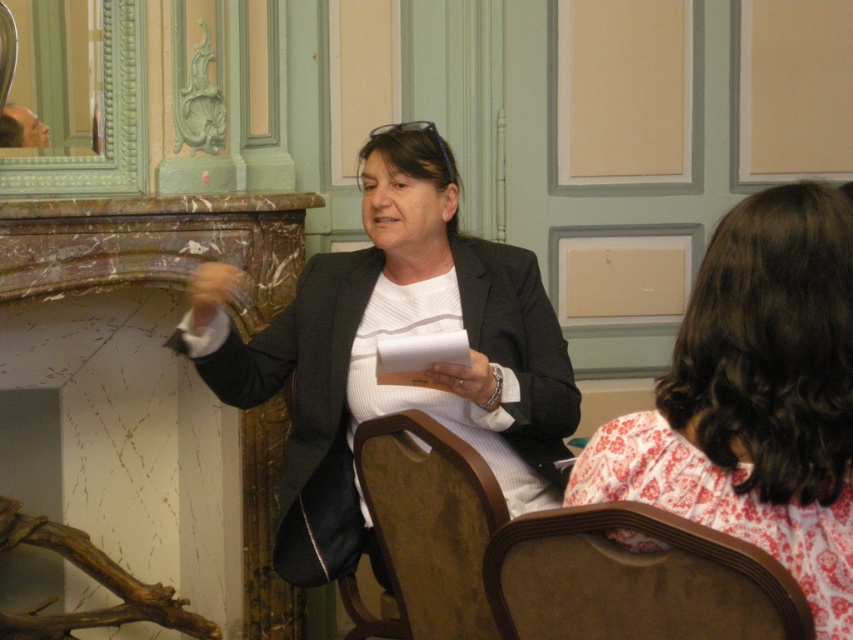
Looking at this image, can you confirm if matte black blazer at center is thinner than white floral dress at center?

In fact, matte black blazer at center might be wider than white floral dress at center.

Is point (436, 237) positioned before point (761, 202)?

No, it is behind (761, 202).

Where is `matte black blazer at center`? The width and height of the screenshot is (853, 640). matte black blazer at center is located at coordinates (387, 333).

Where is `matte black blazer at center`? Image resolution: width=853 pixels, height=640 pixels. matte black blazer at center is located at coordinates (387, 333).

Is white floral dress at center behind beige fabric armchair at lower right?

Yes, white floral dress at center is further from the viewer.

Which is behind, point (682, 412) or point (570, 595)?

The point (570, 595) is more distant.

Describe the element at coordinates (755, 397) in the screenshot. The image size is (853, 640). I see `white floral dress at center` at that location.

Find the location of a particular element. This screenshot has height=640, width=853. white floral dress at center is located at coordinates (755, 397).

Which of these two, white floral dress at center or brown wood chair at center, stands taller?

white floral dress at center

Can you confirm if white floral dress at center is positioned to the left of brown wood chair at center?

Incorrect, white floral dress at center is not on the left side of brown wood chair at center.

This screenshot has height=640, width=853. What do you see at coordinates (755, 397) in the screenshot?
I see `white floral dress at center` at bounding box center [755, 397].

Identify the location of white floral dress at center. The image size is (853, 640). (755, 397).